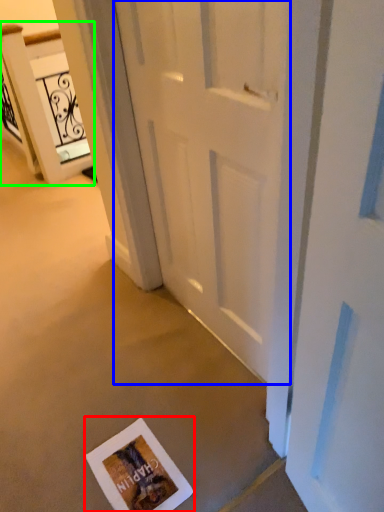
Question: Based on their relative distances, which object is farther from postcard (highlighted by a red box)? Choose from door (highlighted by a blue box) and elevator (highlighted by a green box).

Choices:
 (A) door
 (B) elevator

Answer: (B)